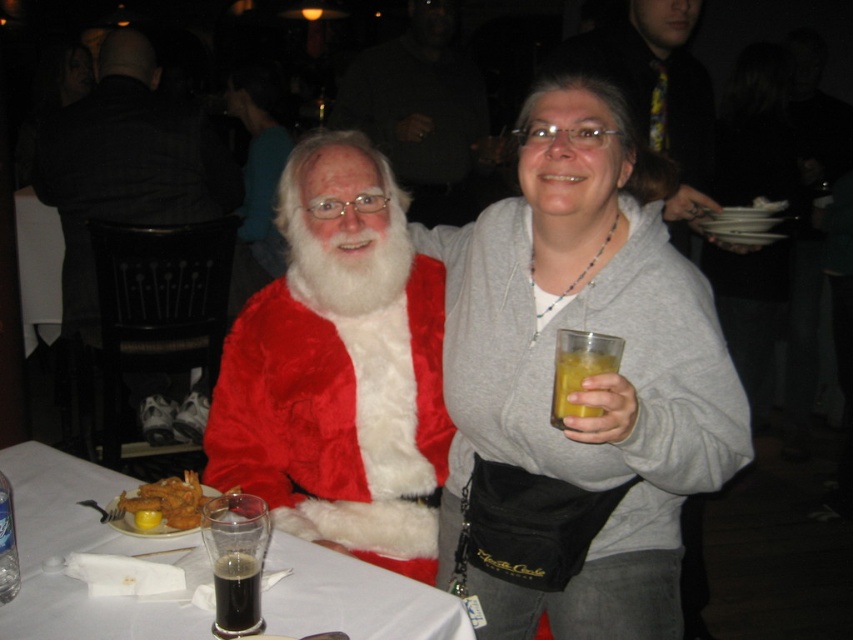
Question: Which point is farther to the camera?

Choices:
 (A) dark glass beer at table center
 (B) matte gray hoodie at center
 (C) white paper napkin at lower left

Answer: (C)

Question: Can you confirm if matte gray hoodie at center is wider than fuzzy red coat at center?

Choices:
 (A) yes
 (B) no

Answer: (B)

Question: Is fuzzy red santa at center closer to camera compared to orange translucent glass at right?

Choices:
 (A) yes
 (B) no

Answer: (B)

Question: Which object is positioned closest to the dark glass beer at table center?

Choices:
 (A) matte gray hoodie at center
 (B) white paper napkin at lower left
 (C) fuzzy red santa at center

Answer: (B)

Question: Can you confirm if white paper napkin at lower left is positioned to the right of orange translucent glass at right?

Choices:
 (A) yes
 (B) no

Answer: (B)

Question: Among these objects, which one is nearest to the camera?

Choices:
 (A) fuzzy red coat at center
 (B) orange translucent glass at right

Answer: (B)